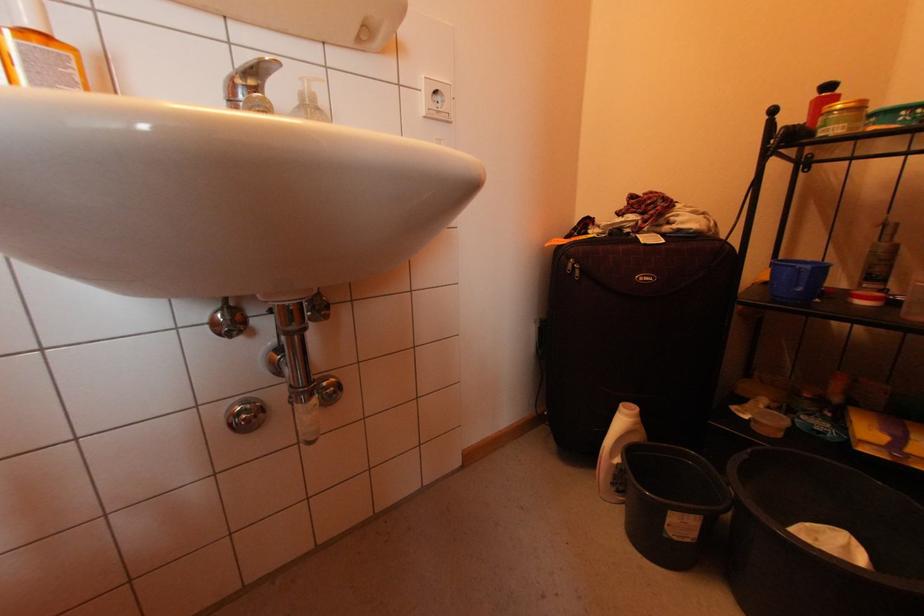
Image resolution: width=924 pixels, height=616 pixels. What do you see at coordinates (307, 89) in the screenshot? I see `the soap dispenser pump` at bounding box center [307, 89].